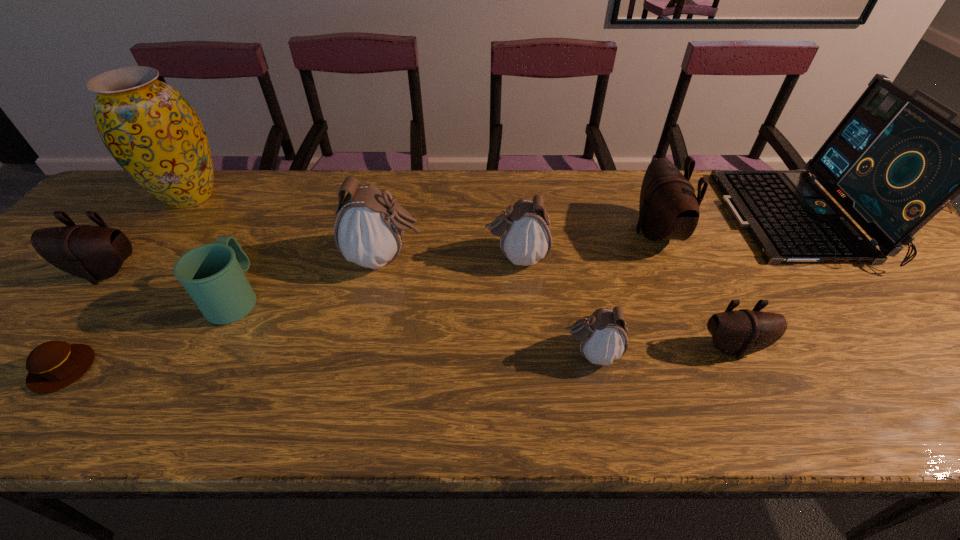
This screenshot has width=960, height=540. I want to click on vacant space located 0.250m on the front-facing side of the nearest white pouch, so click(x=442, y=353).

Identify the location of vacant area situated on the front-facing side of the nearest white pouch. This screenshot has height=540, width=960. (442, 353).

Where is `free space located 0.140m with the flap open on the nearest brown pouch`? Image resolution: width=960 pixels, height=540 pixels. free space located 0.140m with the flap open on the nearest brown pouch is located at coordinates (770, 427).

Where is `vacant space located on the right of the shortest object`? The width and height of the screenshot is (960, 540). vacant space located on the right of the shortest object is located at coordinates (250, 369).

Locate an element on the screen. The image size is (960, 540). vase that is at the far edge is located at coordinates (150, 129).

Find the location of a particular element. laptop computer that is at the far edge is located at coordinates (893, 163).

Locate an element on the screen. The width and height of the screenshot is (960, 540). pouch present at the far edge is located at coordinates (668, 209).

This screenshot has width=960, height=540. What are the coordinates of `object that is at the near edge` in the screenshot? It's located at click(53, 365).

Identify the location of vase positioned at the left edge. (150, 129).

At what (x,y) coordinates should I click in order to perform the action: click on pouch that is at the left edge. Please return your answer as a coordinate pair (x, y). The image size is (960, 540). Looking at the image, I should click on (94, 253).